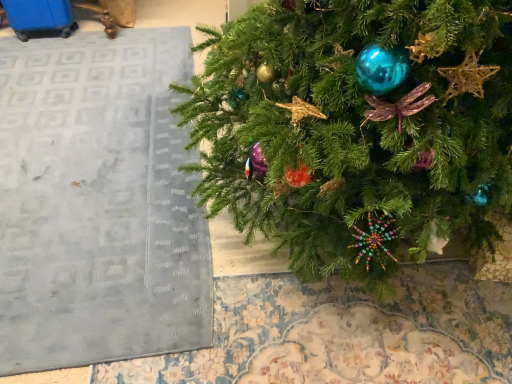
Question: In terms of height, does matte gray rug at lower left look taller or shorter compared to green matte christmas tree at center?

Choices:
 (A) short
 (B) tall

Answer: (A)

Question: Is matte gray rug at lower left spatially inside green matte christmas tree at center, or outside of it?

Choices:
 (A) outside
 (B) inside

Answer: (A)

Question: Based on their positions, is matte gray rug at lower left located to the left or right of green matte christmas tree at center?

Choices:
 (A) left
 (B) right

Answer: (A)

Question: In the image, is green matte christmas tree at center positioned in front of or behind matte gray rug at lower left?

Choices:
 (A) front
 (B) behind

Answer: (A)

Question: Is point (221, 180) closer or farther from the camera than point (197, 230)?

Choices:
 (A) closer
 (B) farther

Answer: (A)

Question: From the image's perspective, is green matte christmas tree at center positioned above or below matte gray rug at lower left?

Choices:
 (A) below
 (B) above

Answer: (B)

Question: Considering the positions of green matte christmas tree at center and matte gray rug at lower left in the image, is green matte christmas tree at center wider or thinner than matte gray rug at lower left?

Choices:
 (A) thin
 (B) wide

Answer: (A)